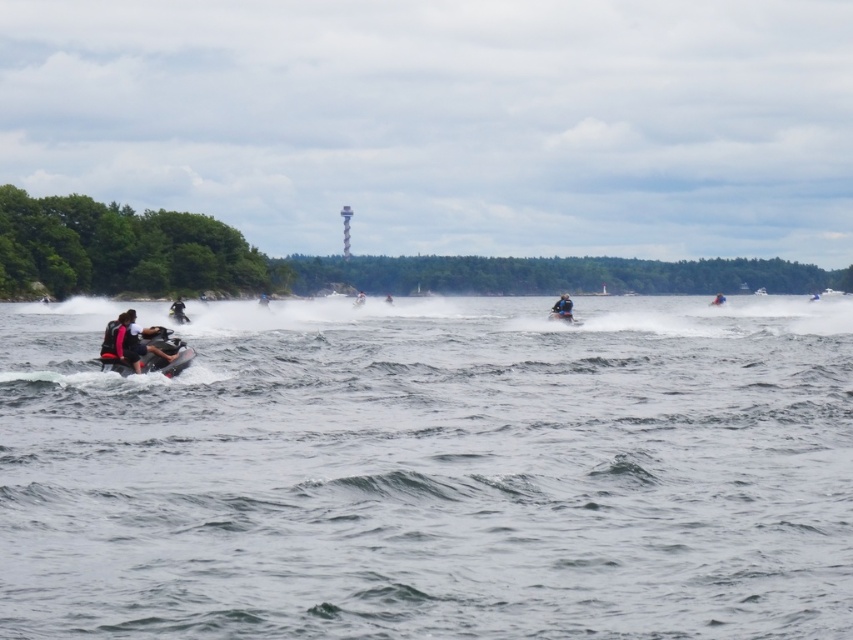
Can you confirm if clear water at lower left is positioned above white plastic jet ski at center?

No, clear water at lower left is not above white plastic jet ski at center.

Who is shorter, clear water at lower left or white plastic jet ski at center?

white plastic jet ski at center is shorter.

Measure the distance between clear water at lower left and camera.

They are 8.45 meters apart.

Find the location of a particular element. clear water at lower left is located at coordinates (432, 472).

Does point (163, 332) come behind point (718, 292)?

That is False.

You are a GUI agent. You are given a task and a screenshot of the screen. Output one action in this format:
    pyautogui.click(x=<x>, y=<y>)
    Task: Click on the black matte jet ski at lower left
    
    Given the screenshot: What is the action you would take?
    pyautogui.click(x=165, y=353)

Does blue rubber jet ski at center appear over white plastic jet ski at center?

Actually, blue rubber jet ski at center is below white plastic jet ski at center.

Which is behind, point (549, 316) or point (357, 304)?

The point (357, 304) is more distant.

This screenshot has width=853, height=640. I want to click on blue rubber jet ski at center, so click(563, 316).

This screenshot has width=853, height=640. Find the location of `blue rubber jet ski at center`. blue rubber jet ski at center is located at coordinates (563, 316).